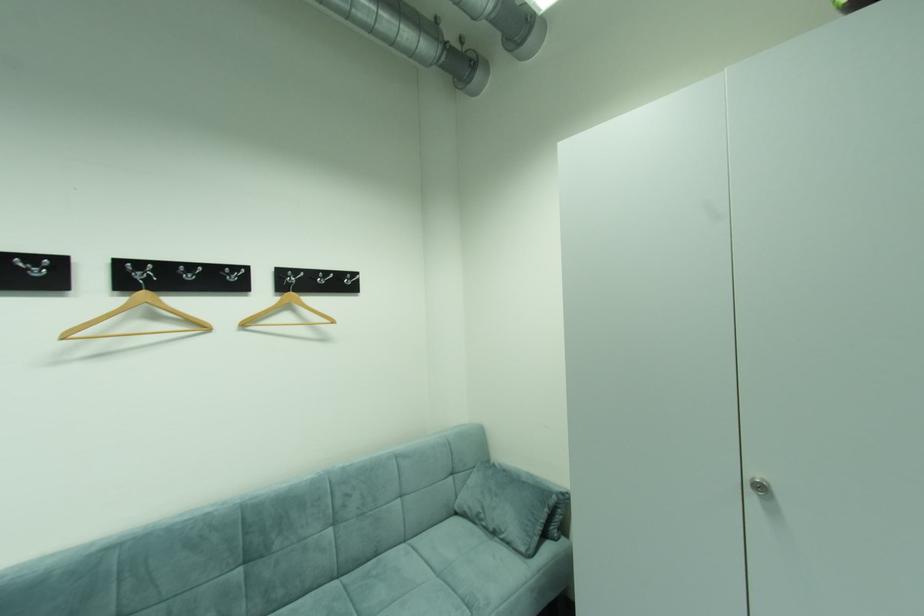
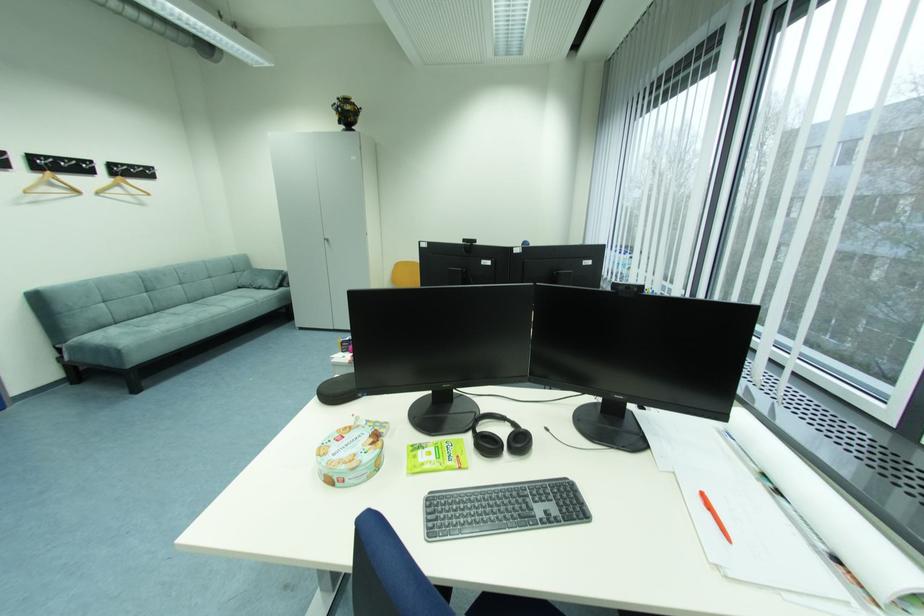
The point at (251, 326) is marked in the first image. Where is the corresponding point in the second image?

(104, 193)